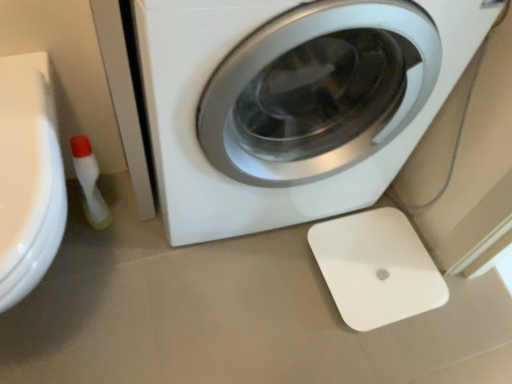
Identify the location of vacant point above white plastic scale at lower right (from a real-world perspective). The width and height of the screenshot is (512, 384). (377, 262).